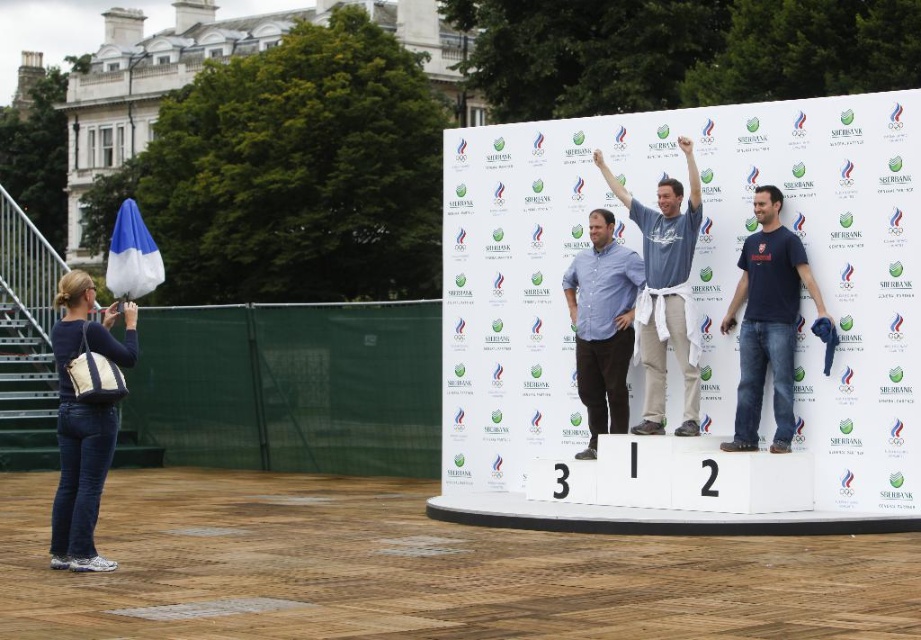
Question: Which of the following is the closest to the observer?

Choices:
 (A) (63, 486)
 (B) (599, 269)
 (C) (741, 371)
 (D) (153, 289)

Answer: (A)

Question: Among these objects, which one is nearest to the camera?

Choices:
 (A) blue fabric umbrella at left
 (B) light blue fabric shirt at center
 (C) dark blue denim jeans at lower left

Answer: (C)

Question: Is dark blue denim jeans at lower left thinner than matte blue shirt at center?

Choices:
 (A) no
 (B) yes

Answer: (A)

Question: Can you confirm if dark blue denim jeans at lower left is positioned below blue fabric umbrella at left?

Choices:
 (A) no
 (B) yes

Answer: (B)

Question: Which point appears closest to the camera in this image?

Choices:
 (A) pos(689,406)
 (B) pos(138,218)

Answer: (A)

Question: Is dark blue denim jeans at lower left further to camera compared to light blue fabric shirt at center?

Choices:
 (A) no
 (B) yes

Answer: (A)